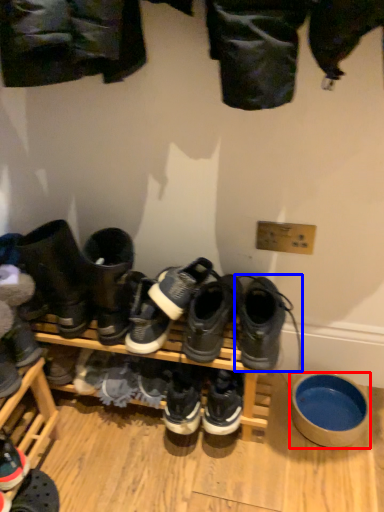
Question: Which object appears closest to the camera in this image, bowl (highlighted by a red box) or footwear (highlighted by a blue box)?

Choices:
 (A) bowl
 (B) footwear

Answer: (B)